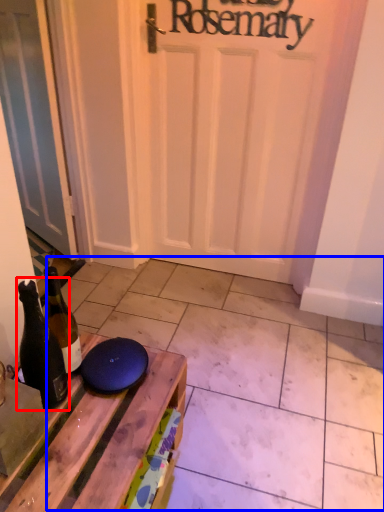
Question: Among these objects, which one is nearest to the camera, bottle (highlighted by a red box) or tile (highlighted by a blue box)?

Choices:
 (A) bottle
 (B) tile

Answer: (A)